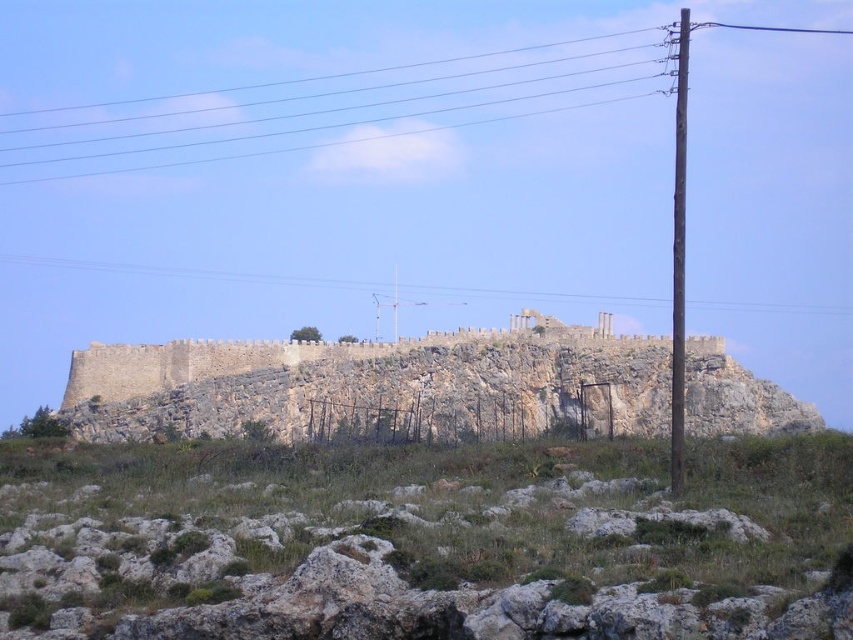
Between rustic stone wall at center and metallic wire at upper center, which one has more height?

rustic stone wall at center

Is point (662, 433) closer to camera compared to point (721, 307)?

Yes, it is.

Where is `rustic stone wall at center`? rustic stone wall at center is located at coordinates (360, 380).

Who is lower down, rocky terrain at center or rustic stone wall at center?

Positioned lower is rocky terrain at center.

Is the position of rocky terrain at center more distant than that of rustic stone wall at center?

No.

Between point (78, 630) and point (184, 417), which one is positioned in front?

Point (78, 630) is in front.

What are the coordinates of `rocky terrain at center` in the screenshot? It's located at (426, 541).

Describe the element at coordinates (426, 541) in the screenshot. I see `rocky terrain at center` at that location.

What are the coordinates of `rocky terrain at center` in the screenshot? It's located at (426, 541).